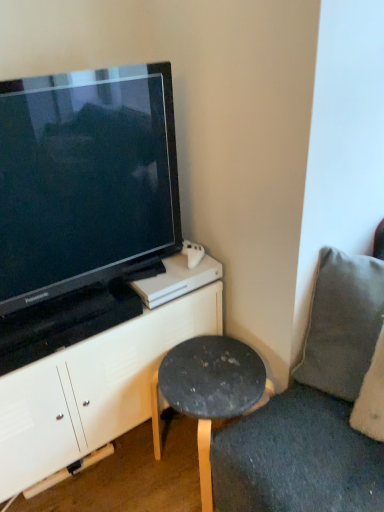
Question: Can we say black glossy television at upper left lies outside white matte cabinet at upper left?

Choices:
 (A) yes
 (B) no

Answer: (A)

Question: From a real-world perspective, does black glossy television at upper left sit lower than white matte cabinet at upper left?

Choices:
 (A) no
 (B) yes

Answer: (A)

Question: Can you see black glossy television at upper left touching white matte cabinet at upper left?

Choices:
 (A) no
 (B) yes

Answer: (A)

Question: Would you say black glossy television at upper left is a long distance from white matte cabinet at upper left?

Choices:
 (A) yes
 (B) no

Answer: (B)

Question: From the image's perspective, would you say black glossy television at upper left is shown under white matte cabinet at upper left?

Choices:
 (A) yes
 (B) no

Answer: (B)

Question: In terms of size, does dark gray stone stool at lower right appear bigger or smaller than gray fabric pillow at right?

Choices:
 (A) small
 (B) big

Answer: (B)

Question: Choose the correct answer: Is dark gray stone stool at lower right inside gray fabric pillow at right or outside it?

Choices:
 (A) outside
 (B) inside

Answer: (A)

Question: Looking at their shapes, would you say dark gray stone stool at lower right is wider or thinner than gray fabric pillow at right?

Choices:
 (A) wide
 (B) thin

Answer: (A)

Question: From a real-world perspective, is dark gray stone stool at lower right positioned above or below gray fabric pillow at right?

Choices:
 (A) below
 (B) above

Answer: (A)

Question: In terms of size, does white matte cabinet at upper left appear bigger or smaller than black glossy television at upper left?

Choices:
 (A) small
 (B) big

Answer: (B)

Question: In the image, is white matte cabinet at upper left positioned in front of or behind black glossy television at upper left?

Choices:
 (A) front
 (B) behind

Answer: (B)

Question: Looking at their shapes, would you say white matte cabinet at upper left is wider or thinner than black glossy television at upper left?

Choices:
 (A) wide
 (B) thin

Answer: (A)

Question: From a real-world perspective, is white matte cabinet at upper left above or below black glossy television at upper left?

Choices:
 (A) above
 (B) below

Answer: (B)

Question: Looking at the image, does dark gray stone stool at lower right seem bigger or smaller compared to white matte cabinet at upper left?

Choices:
 (A) big
 (B) small

Answer: (B)

Question: Is dark gray stone stool at lower right taller or shorter than white matte cabinet at upper left?

Choices:
 (A) tall
 (B) short

Answer: (B)